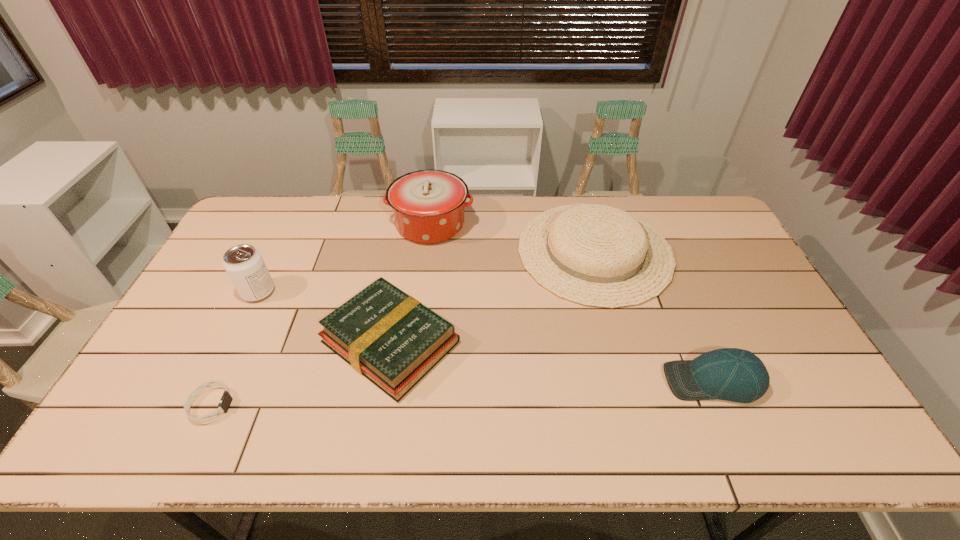
Locate an element on the screen. The width and height of the screenshot is (960, 540). free space at the near edge of the desktop is located at coordinates (257, 418).

Identify the location of vacant space at the left edge. The height and width of the screenshot is (540, 960). (194, 335).

Find the location of `vacant space at the right edge`. vacant space at the right edge is located at coordinates (769, 301).

You are a GUI agent. You are given a task and a screenshot of the screen. Output one action in this format:
    pyautogui.click(x=<x>, y=<y>)
    Task: Click on the vacant space that is in between the hardback book and the shortest object
    This screenshot has width=960, height=540.
    Given the screenshot: What is the action you would take?
    pyautogui.click(x=300, y=374)

The image size is (960, 540). I want to click on vacant space that's between the hardback book and the baseball cap, so click(x=552, y=361).

Locate an element on the screen. The image size is (960, 540). empty location between the hardback book and the sunhat is located at coordinates (492, 296).

In order to click on empty space between the baseball cap and the hardback book in this screenshot , I will do `click(552, 361)`.

This screenshot has width=960, height=540. I want to click on vacant point located between the shortest object and the soda can, so click(234, 348).

Find the location of a particular element. The width and height of the screenshot is (960, 540). vacant region between the baseball cap and the hardback book is located at coordinates (552, 361).

Where is `free space between the shortest object and the baseball cap`? Image resolution: width=960 pixels, height=540 pixels. free space between the shortest object and the baseball cap is located at coordinates (462, 393).